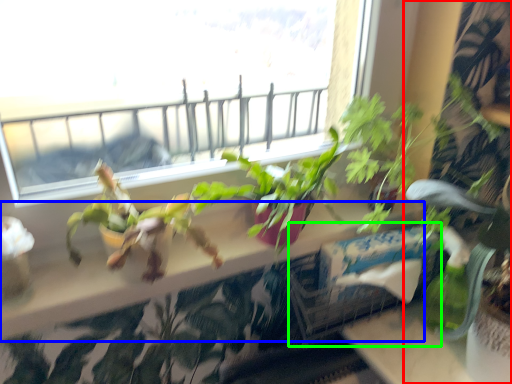
Question: Which object is positioned closest to houseplant (highlighted by a red box)? Select from window sill (highlighted by a blue box) and window box (highlighted by a green box).

Choices:
 (A) window sill
 (B) window box

Answer: (B)